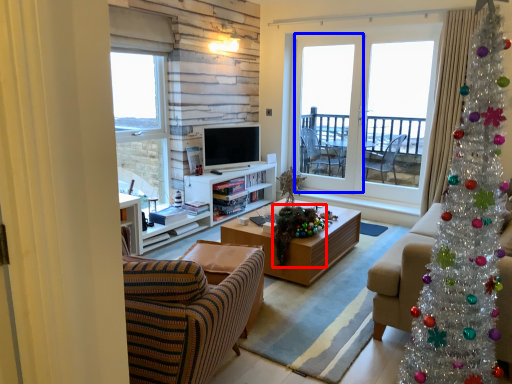
Question: Which of the following is the farthest to the observer, christmas decoration (highlighted by a red box) or screen door (highlighted by a blue box)?

Choices:
 (A) christmas decoration
 (B) screen door

Answer: (B)